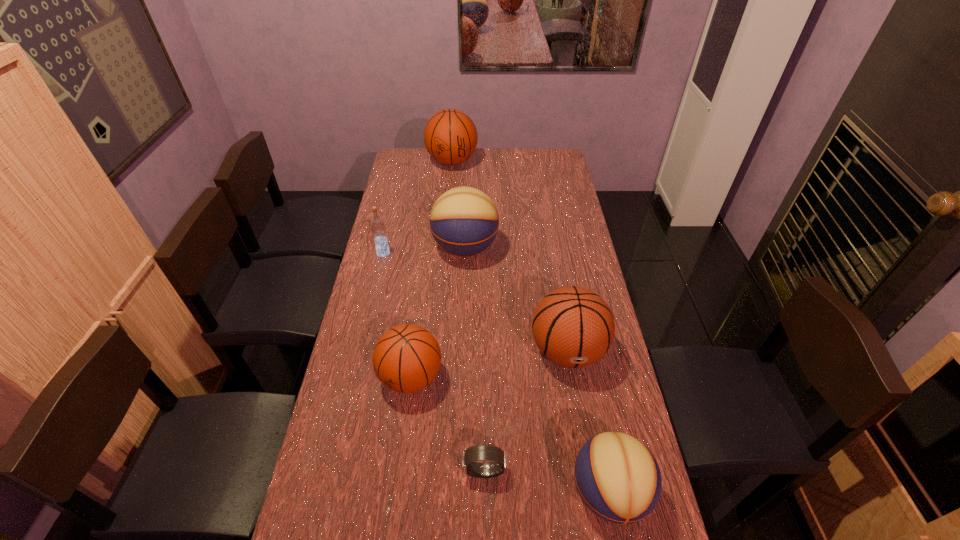
Identify the location of vodka at the left edge. Image resolution: width=960 pixels, height=540 pixels. (378, 228).

The image size is (960, 540). Find the location of `object located at the far left corner`. object located at the far left corner is located at coordinates (450, 136).

Where is `blank space at the left edge of the desktop`? Image resolution: width=960 pixels, height=540 pixels. blank space at the left edge of the desktop is located at coordinates (412, 222).

Image resolution: width=960 pixels, height=540 pixels. I want to click on vacant space at the right edge, so click(552, 199).

Locate an element on the screen. free space that is in between the rightmost orange basketball and the shortest object is located at coordinates (525, 411).

Where is `free space that is in between the smallest orange basketball and the watch`? free space that is in between the smallest orange basketball and the watch is located at coordinates (447, 424).

You are a GUI agent. You are given a task and a screenshot of the screen. Output one action in this format:
    pyautogui.click(x=<x>, y=<y>)
    Task: Click on the free space that is in between the watch and the left blue basketball
    
    Given the screenshot: What is the action you would take?
    pyautogui.click(x=474, y=360)

This screenshot has width=960, height=540. Find the location of `free space between the rightmost orange basketball and the farthest basketball`. free space between the rightmost orange basketball and the farthest basketball is located at coordinates (510, 256).

Find the location of a particular element. unoccupied area between the rightmost orange basketball and the vodka is located at coordinates (475, 302).

This screenshot has height=540, width=960. I want to click on unoccupied area between the vodka and the nearer blue basketball, so click(496, 373).